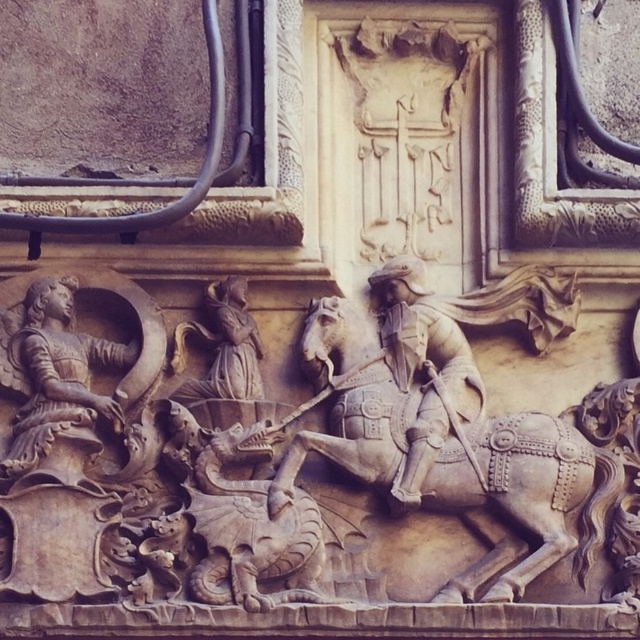
Is point (314, 508) closer to camera compared to point (84, 432)?

Yes, it is in front of point (84, 432).

In the scene shown: Which is more to the left, stone dragon at center or bronze relief figure at left?

bronze relief figure at left is more to the left.

The width and height of the screenshot is (640, 640). I want to click on stone dragon at center, so click(x=240, y=516).

Can you confirm if stone dragon at center is shorter than stone figure at center?

Indeed, stone dragon at center has a lesser height compared to stone figure at center.

Which is more to the right, stone dragon at center or stone figure at center?

stone dragon at center

Describe the element at coordinates (240, 516) in the screenshot. I see `stone dragon at center` at that location.

You are a GUI agent. You are given a task and a screenshot of the screen. Output one action in this format:
    pyautogui.click(x=<x>, y=<y>)
    Task: Click on the stone dragon at center
    The width and height of the screenshot is (640, 640).
    Given the screenshot: What is the action you would take?
    pyautogui.click(x=240, y=516)

Which of these two, beige stone horse at center or bronze relief figure at left, stands taller?

beige stone horse at center is taller.

Does beige stone horse at center have a larger size compared to bronze relief figure at left?

Yes.

Identify the location of beige stone horse at center. This screenshot has width=640, height=640. (522, 496).